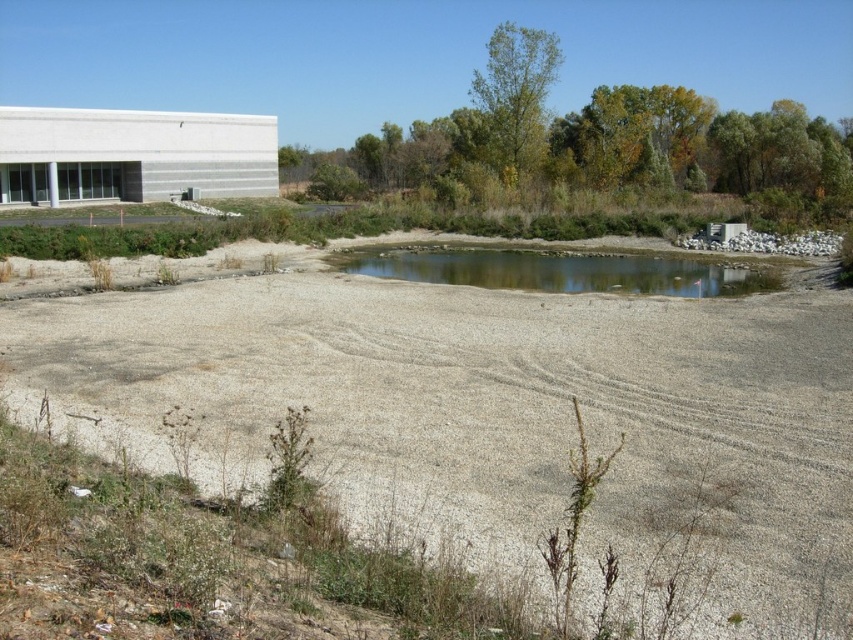
From the picture: Does gray gravel field at center have a smaller size compared to clear water at center?

Actually, gray gravel field at center might be larger than clear water at center.

What do you see at coordinates (492, 412) in the screenshot?
I see `gray gravel field at center` at bounding box center [492, 412].

What do you see at coordinates (492, 412) in the screenshot?
I see `gray gravel field at center` at bounding box center [492, 412].

This screenshot has height=640, width=853. Find the location of `gray gravel field at center`. gray gravel field at center is located at coordinates (492, 412).